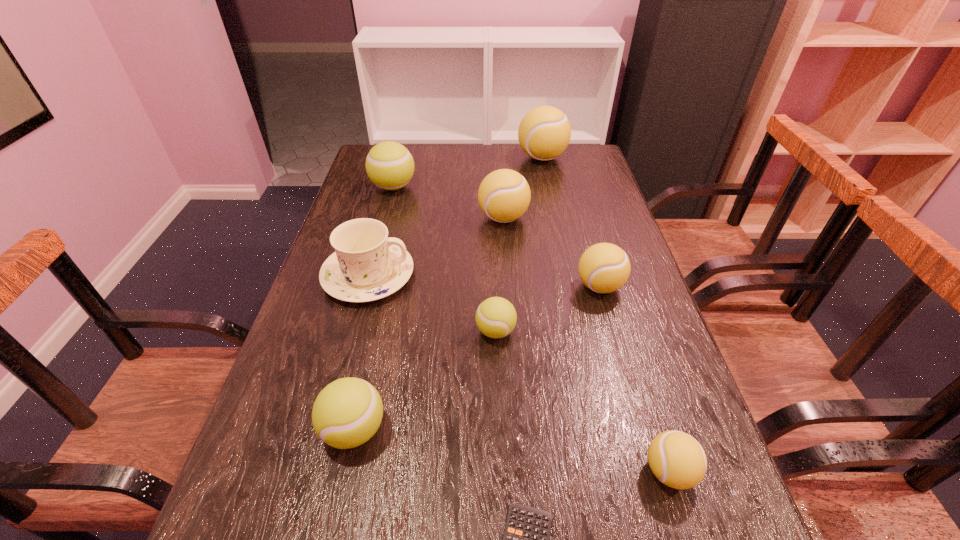
Identify the location of vacant space located on the left of the nearest yellow tennis ball. The image size is (960, 540). (515, 471).

Locate an element on the screen. This screenshot has width=960, height=540. chinaware at the left edge is located at coordinates (367, 265).

Identify the location of object at the far left corner. (389, 165).

Where is `object located at the far right corner`? The width and height of the screenshot is (960, 540). object located at the far right corner is located at coordinates (544, 133).

Find the location of `vacant space at the far edge of the desktop`. vacant space at the far edge of the desktop is located at coordinates (423, 172).

In the image, there is a desktop. At what (x,y) coordinates should I click in order to perform the action: click on free space at the left edge. Please return your answer as a coordinate pair (x, y). The height and width of the screenshot is (540, 960). Looking at the image, I should click on (364, 218).

The height and width of the screenshot is (540, 960). What are the coordinates of `vacant region at the right edge of the desktop` in the screenshot? It's located at (604, 342).

In order to click on vacant region at the far left corner in this screenshot , I will do `click(360, 171)`.

This screenshot has width=960, height=540. In the image, there is a desktop. In order to click on vacant space at the far right corner in this screenshot , I will do `click(572, 158)`.

Where is `free area in between the chinaware and the third smallest yellow tennis ball`? This screenshot has height=540, width=960. free area in between the chinaware and the third smallest yellow tennis ball is located at coordinates (436, 247).